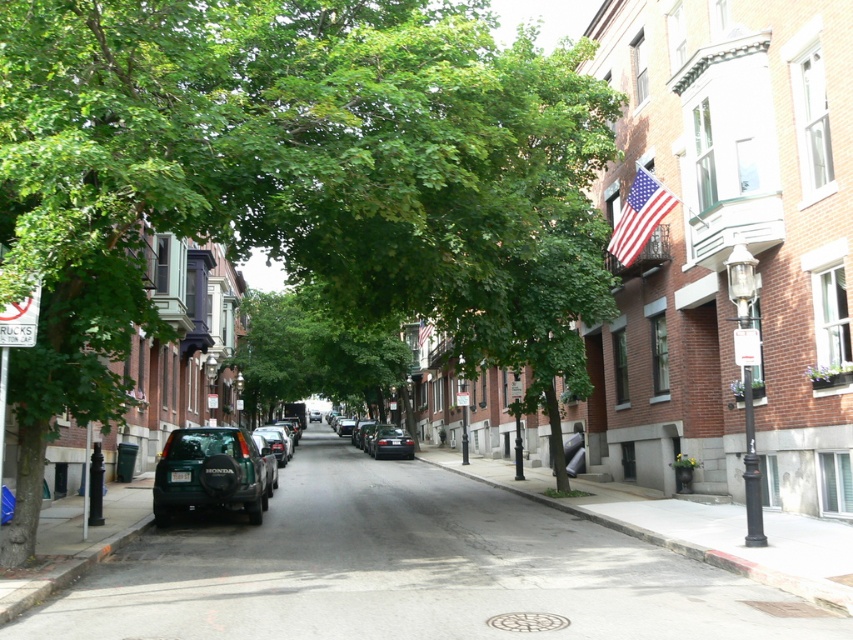
You are a delivery driver who needs to park your truck between the green leafy tree at center and the matte black car at center. Can your truck fit in the space between them?

The green leafy tree at center is larger than the matte black car at center, so the space between them might be sufficient for your truck. However, without knowing the exact dimensions of the truck and the available space, it is difficult to determine if it will fit.

You are a pedestrian standing on the sidewalk and want to cross the street to the other side. There is a green leafy tree at center and a matte black car at center in your path. Which object is blocking your view of the other side of the street?

The green leafy tree at center is located above the matte black car at center, so it is blocking your view of the other side of the street.